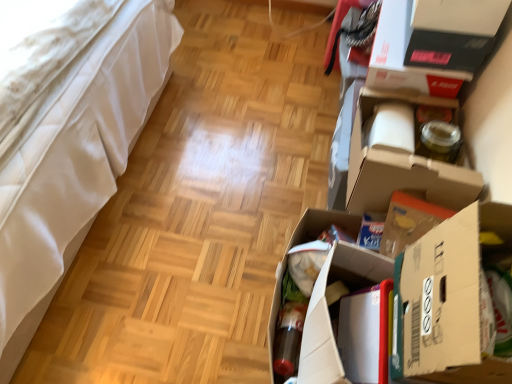
Question: Can you confirm if white cardboard box at right, the third cardboard box from the back, is taller than cardboard box at lower right, the second cardboard box in the back-to-front sequence?

Choices:
 (A) yes
 (B) no

Answer: (A)

Question: Can you confirm if white cardboard box at right, the 1th cardboard box in the front-to-back sequence, is bigger than cardboard box at lower right, acting as the second cardboard box starting from the front?

Choices:
 (A) no
 (B) yes

Answer: (B)

Question: Is white cardboard box at right, the third cardboard box from the back, positioned beyond the bounds of cardboard box at lower right, acting as the second cardboard box starting from the front?

Choices:
 (A) yes
 (B) no

Answer: (A)

Question: Does white cardboard box at right, the third cardboard box from the back, turn towards cardboard box at lower right, acting as the second cardboard box starting from the front?

Choices:
 (A) no
 (B) yes

Answer: (A)

Question: Is cardboard box at lower right, the second cardboard box in the back-to-front sequence, surrounded by white cardboard box at right, the 1th cardboard box in the front-to-back sequence?

Choices:
 (A) yes
 (B) no

Answer: (B)

Question: Considering the relative sizes of white cardboard box at right, the 1th cardboard box in the front-to-back sequence, and cardboard box at lower right, the second cardboard box in the back-to-front sequence, in the image provided, is white cardboard box at right, the 1th cardboard box in the front-to-back sequence, thinner than cardboard box at lower right, the second cardboard box in the back-to-front sequence,?

Choices:
 (A) yes
 (B) no

Answer: (A)

Question: Does cardboard box at lower right, acting as the second cardboard box starting from the front, have a larger size compared to matte black storage box at upper right?

Choices:
 (A) yes
 (B) no

Answer: (A)

Question: Is cardboard box at lower right, acting as the second cardboard box starting from the front, outside matte black storage box at upper right?

Choices:
 (A) no
 (B) yes

Answer: (B)

Question: Can you confirm if cardboard box at lower right, the second cardboard box in the back-to-front sequence, is shorter than matte black storage box at upper right?

Choices:
 (A) yes
 (B) no

Answer: (B)

Question: Does cardboard box at lower right, the second cardboard box in the back-to-front sequence, have a lesser width compared to matte black storage box at upper right?

Choices:
 (A) yes
 (B) no

Answer: (B)

Question: Is cardboard box at lower right, the second cardboard box in the back-to-front sequence, facing towards matte black storage box at upper right?

Choices:
 (A) no
 (B) yes

Answer: (A)

Question: Is cardboard box at lower right, the second cardboard box in the back-to-front sequence, further to the viewer compared to matte black storage box at upper right?

Choices:
 (A) yes
 (B) no

Answer: (B)

Question: From a real-world perspective, is white leather bed at left physically below white cardboard box at right, the third cardboard box from the back?

Choices:
 (A) yes
 (B) no

Answer: (A)